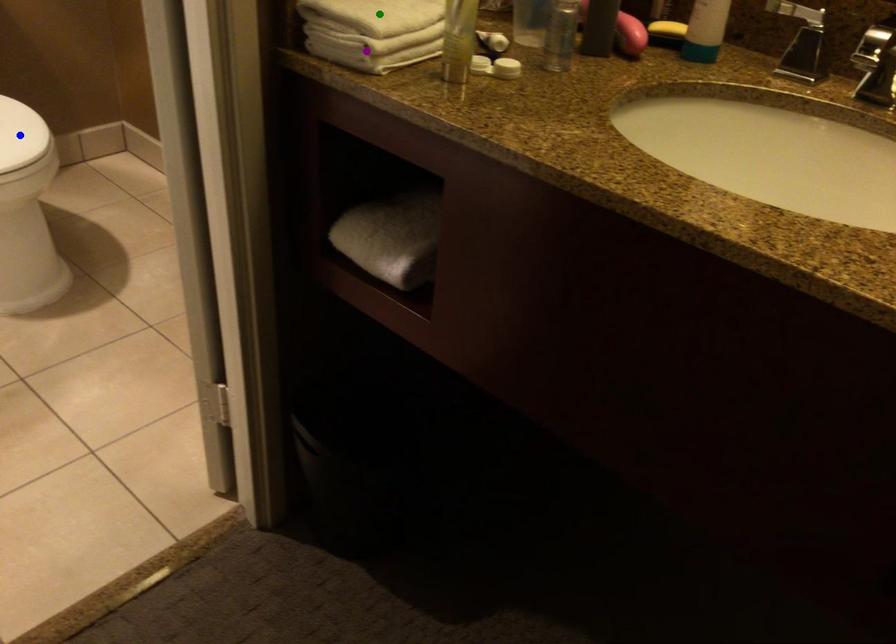
Order these from nearest to farthest:
blue point | purple point | green point

purple point
green point
blue point